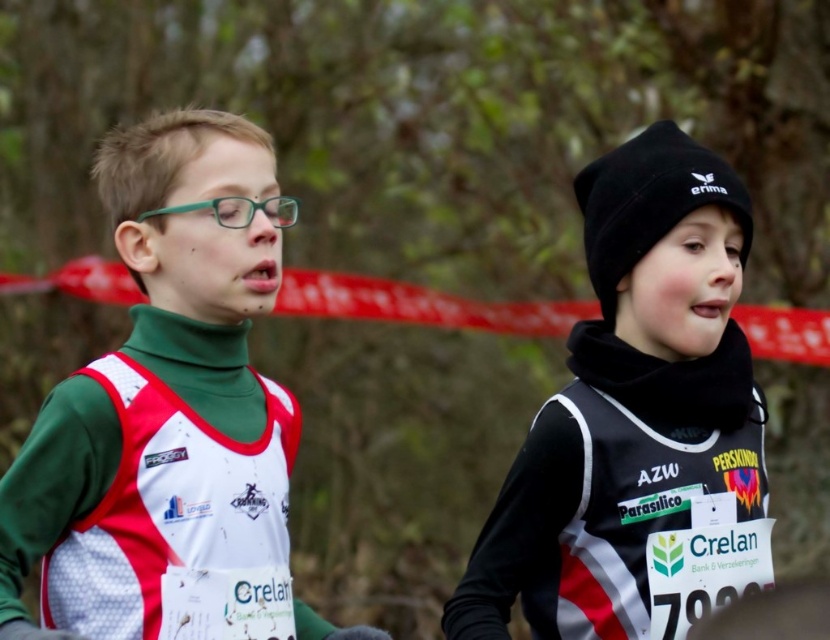
Question: Which is farther from the matte green turtleneck at center?

Choices:
 (A) black matte beanie at upper right
 (B) red tape at center

Answer: (B)

Question: Does black matte beanie at upper right appear under matte green turtleneck at center?

Choices:
 (A) no
 (B) yes

Answer: (B)

Question: Does black matte beanie at upper right lie in front of matte green turtleneck at center?

Choices:
 (A) no
 (B) yes

Answer: (A)

Question: Can you confirm if black matte beanie at upper right is positioned above matte green turtleneck at center?

Choices:
 (A) yes
 (B) no

Answer: (B)

Question: Which of these objects is positioned closest to the black matte beanie at upper right?

Choices:
 (A) matte green turtleneck at center
 (B) red tape at center

Answer: (A)

Question: Which object is positioned closest to the matte green turtleneck at center?

Choices:
 (A) red tape at center
 (B) black matte beanie at upper right

Answer: (B)